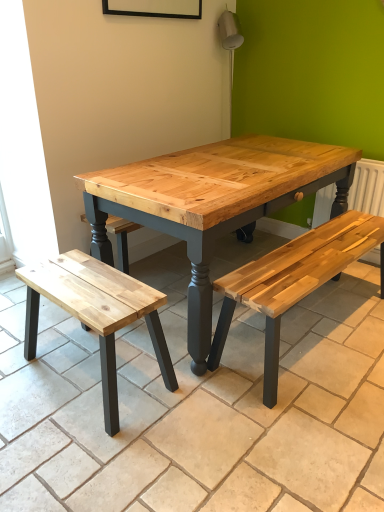
Question: From a real-world perspective, is white painted radiator at right positioned above or below natural wood bench at lower left?

Choices:
 (A) above
 (B) below

Answer: (A)

Question: Is white painted radiator at right to the left or to the right of natural wood bench at lower left in the image?

Choices:
 (A) right
 (B) left

Answer: (A)

Question: Estimate the real-world distances between objects in this image. Which object is farther from the white painted radiator at right?

Choices:
 (A) natural wood bench at lower right
 (B) natural wood bench at lower left

Answer: (B)

Question: Estimate the real-world distances between objects in this image. Which object is farther from the natural wood bench at lower left?

Choices:
 (A) white painted radiator at right
 (B) natural wood bench at lower right

Answer: (A)